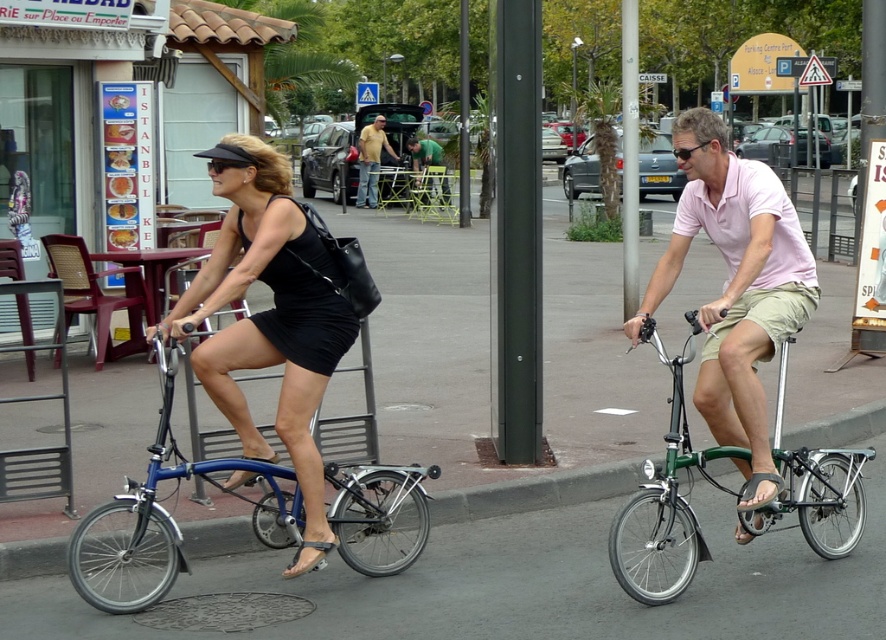
Question: Which object appears farthest from the camera in this image?

Choices:
 (A) dark green metallic pole at center
 (B) blue metallic bicycle at left
 (C) metallic pole at center
 (D) green fabric shirt at center

Answer: (D)

Question: Is green fabric table at center wider than green fabric shirt at center?

Choices:
 (A) yes
 (B) no

Answer: (A)

Question: Estimate the real-world distances between objects in this image. Which object is farther from the metallic pole at center?

Choices:
 (A) green metallic pole at center
 (B) yellow cotton shirt at center
 (C) blue metallic bicycle at left
 (D) pink cotton polo shirt at center

Answer: (B)

Question: Does green metallic bicycle at right have a greater width compared to metallic pole at center?

Choices:
 (A) yes
 (B) no

Answer: (B)

Question: Does blue metallic bicycle at left lie behind metallic pole at center?

Choices:
 (A) yes
 (B) no

Answer: (B)

Question: Which is nearer to the metallic pole at center?

Choices:
 (A) green fabric table at center
 (B) green metallic bicycle at right

Answer: (B)